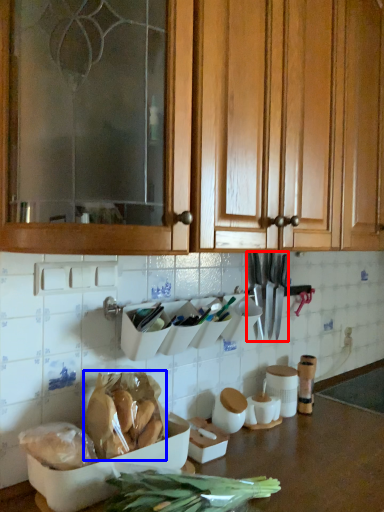
Question: Which of the following is the farthest to the observer, cutlery (highlighted by a red box) or food (highlighted by a blue box)?

Choices:
 (A) cutlery
 (B) food

Answer: (A)